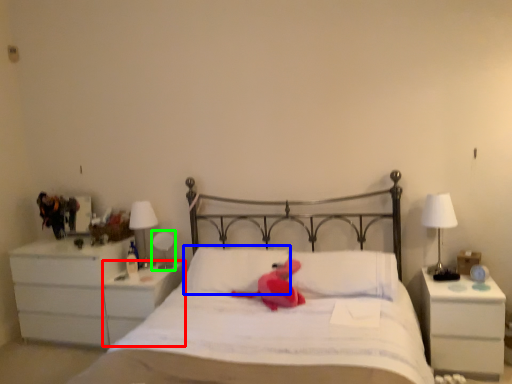
Question: Estimate the real-world distances between objects in this image. Which object is farther from nightstand (highlighted by a red box), pillow (highlighted by a blue box) or table lamp (highlighted by a green box)?

Choices:
 (A) pillow
 (B) table lamp

Answer: (A)